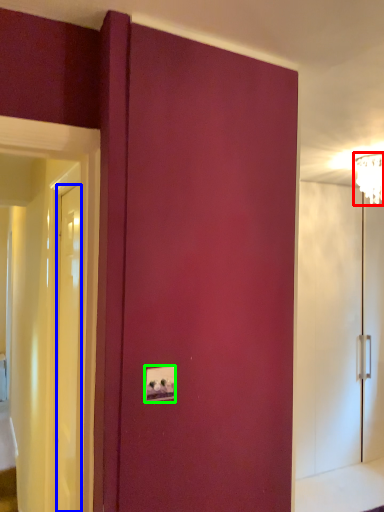
Question: Which is farther away from light fixture (highlighted by a red box)? door (highlighted by a blue box) or light switch (highlighted by a green box)?

Choices:
 (A) door
 (B) light switch

Answer: (B)